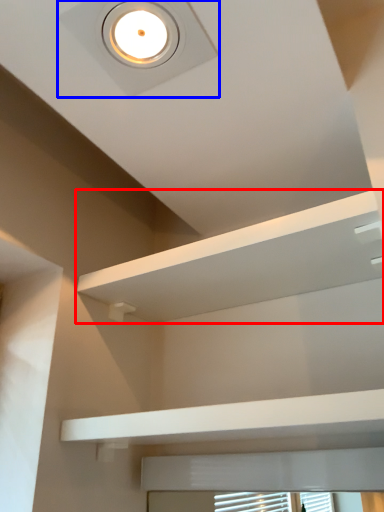
Question: Which object appears closest to the camera in this image, shelf (highlighted by a red box) or droplight (highlighted by a blue box)?

Choices:
 (A) shelf
 (B) droplight

Answer: (B)